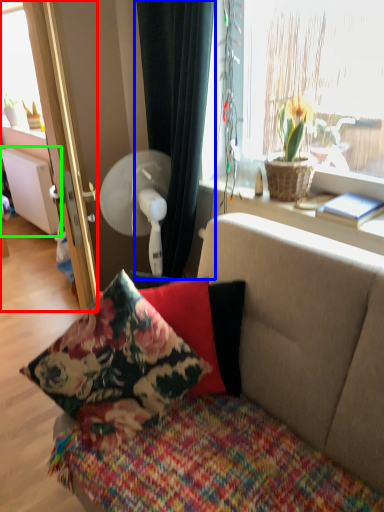
Question: Based on their relative distances, which object is nearer to screen door (highlighted by a red box)? Choose from curtain (highlighted by a blue box) and radiator (highlighted by a green box).

Choices:
 (A) curtain
 (B) radiator

Answer: (A)